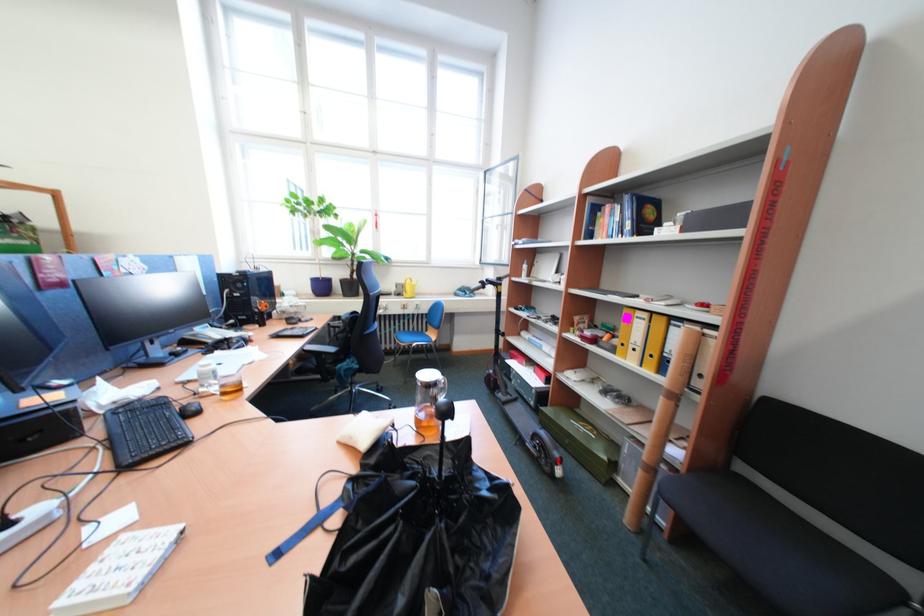
This screenshot has width=924, height=616. In order to click on yellow binder finger hole in this screenshot , I will do `click(408, 286)`.